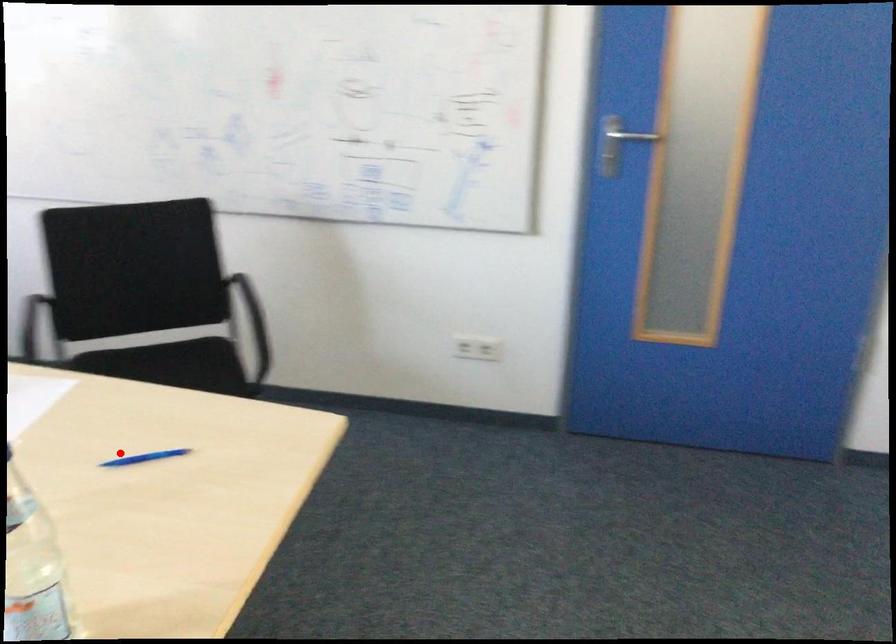
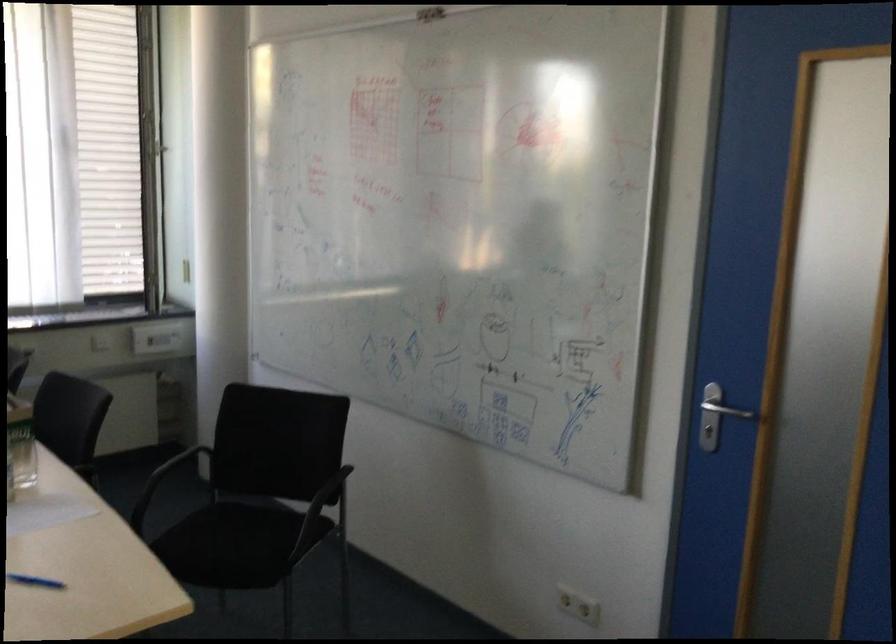
In the second image, find the point that corresponds to the highlighted location in the first image.

(35, 581)